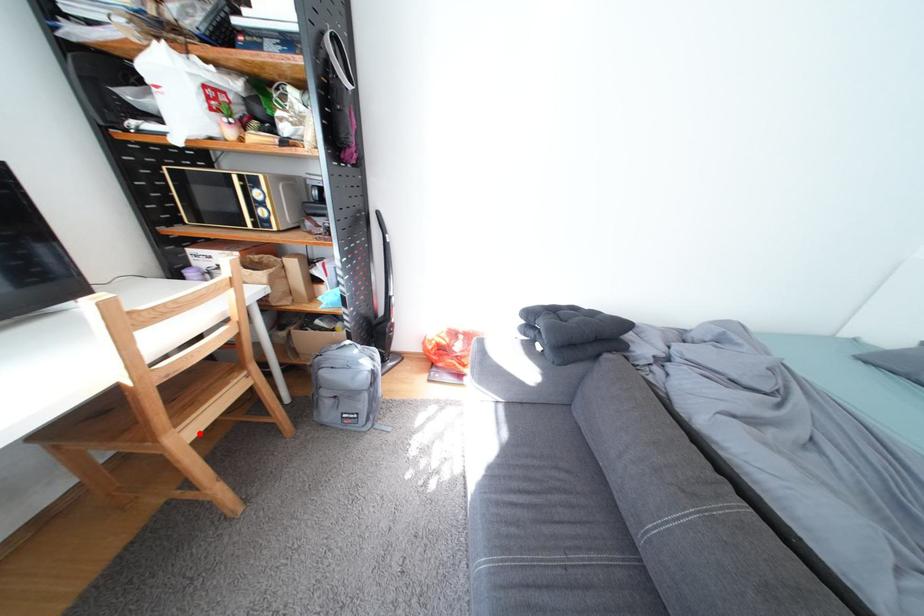
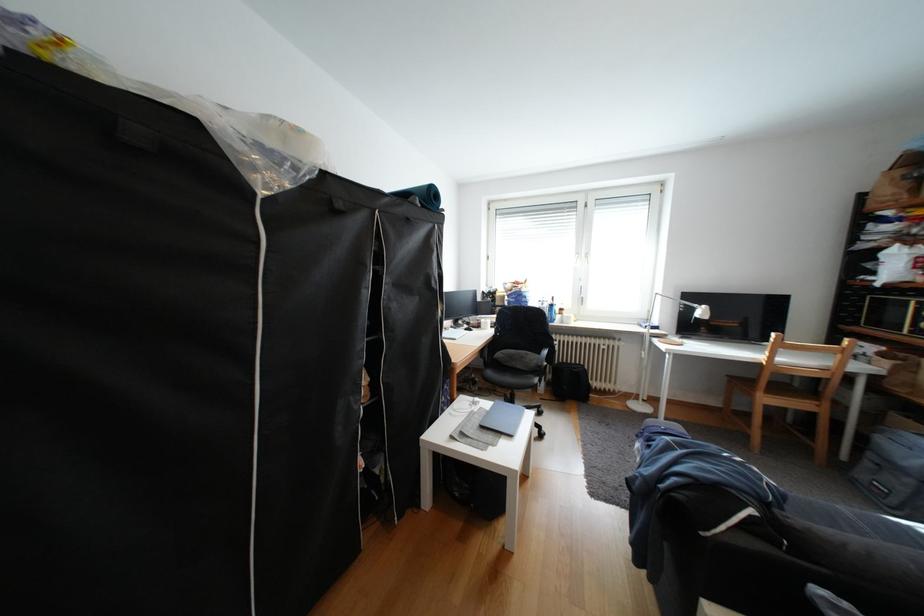
The point at the highlighted location is marked in the first image. Where is the corresponding point in the second image?

(779, 400)